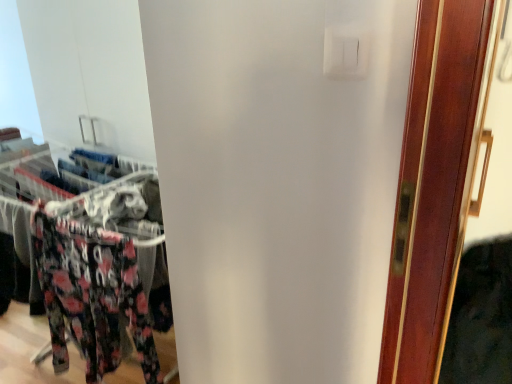
Question: Does floral fabric pants at left appear on the left side of white plastic light switch at upper center?

Choices:
 (A) no
 (B) yes

Answer: (B)

Question: Is floral fabric pants at left bigger than white plastic light switch at upper center?

Choices:
 (A) yes
 (B) no

Answer: (A)

Question: Does floral fabric pants at left have a greater height compared to white plastic light switch at upper center?

Choices:
 (A) no
 (B) yes

Answer: (B)

Question: From the image's perspective, is floral fabric pants at left over white plastic light switch at upper center?

Choices:
 (A) no
 (B) yes

Answer: (A)

Question: From a real-world perspective, is floral fabric pants at left over white plastic light switch at upper center?

Choices:
 (A) yes
 (B) no

Answer: (B)

Question: Is floral fabric pants at left positioned behind white plastic light switch at upper center?

Choices:
 (A) yes
 (B) no

Answer: (A)

Question: Is white plastic light switch at upper center shorter than floral fabric pants at left?

Choices:
 (A) no
 (B) yes

Answer: (B)

Question: Could you tell me if white plastic light switch at upper center is turned towards floral fabric pants at left?

Choices:
 (A) yes
 (B) no

Answer: (B)

Question: From a real-world perspective, is white plastic light switch at upper center physically above floral fabric pants at left?

Choices:
 (A) no
 (B) yes

Answer: (B)

Question: Is white plastic light switch at upper center in contact with floral fabric pants at left?

Choices:
 (A) yes
 (B) no

Answer: (B)

Question: Does white plastic light switch at upper center have a greater width compared to floral fabric pants at left?

Choices:
 (A) no
 (B) yes

Answer: (A)

Question: From the image's perspective, is white plastic light switch at upper center on top of floral fabric pants at left?

Choices:
 (A) yes
 (B) no

Answer: (A)

Question: In the image, is floral fabric pants at left positioned in front of or behind white plastic light switch at upper center?

Choices:
 (A) front
 (B) behind

Answer: (B)